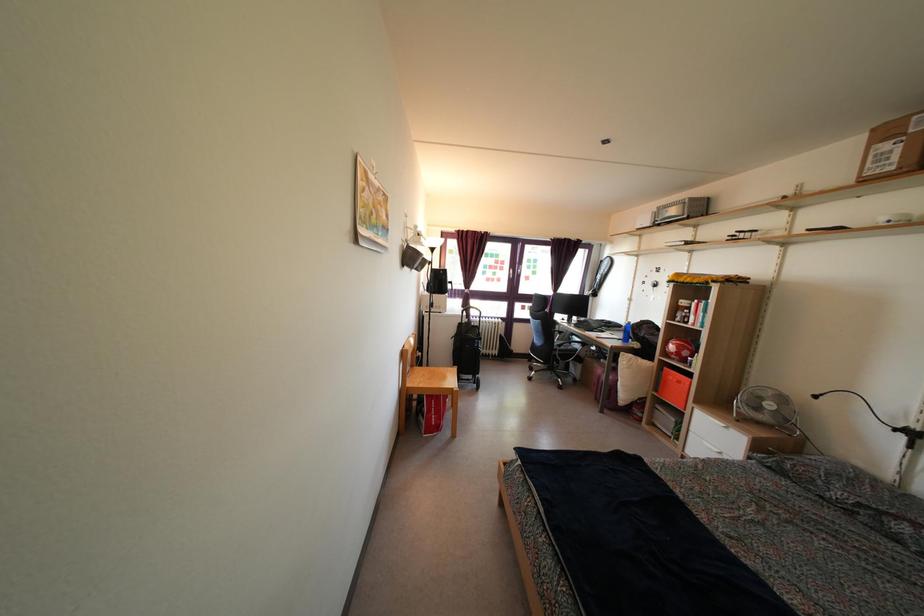
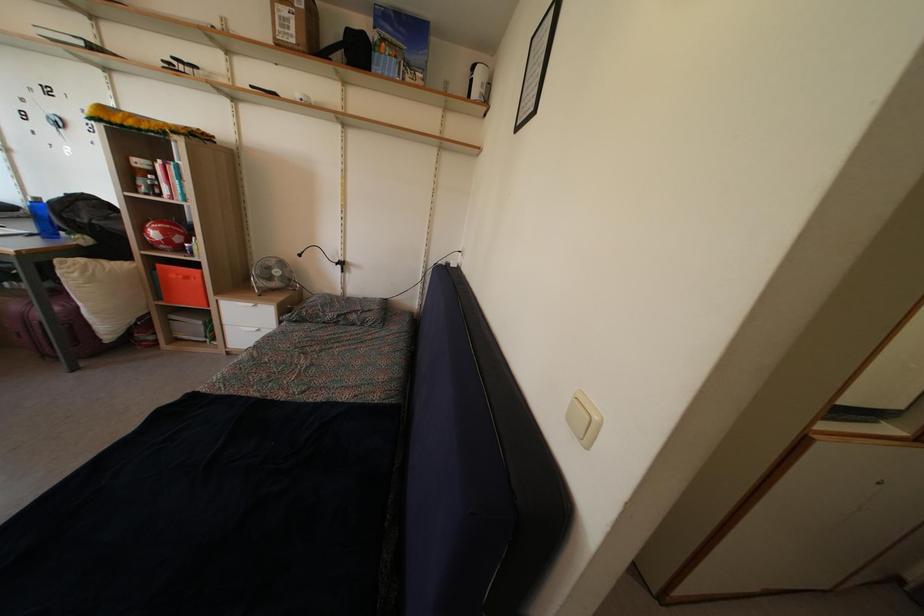
Locate, in the second image, the point that corresponds to (x=891, y=484) in the first image.

(342, 301)